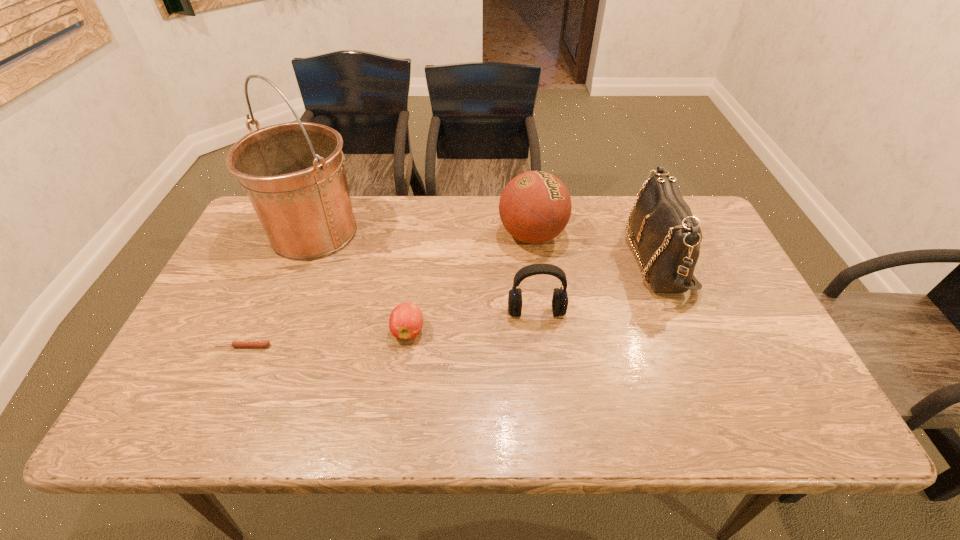
The image size is (960, 540). What are the coordinates of `object that is positioned at the right edge` in the screenshot? It's located at (667, 235).

At what (x,y) coordinates should I click in order to perform the action: click on object that is at the far left corner. Please return your answer as a coordinate pair (x, y). Looking at the image, I should click on [294, 174].

What are the coordinates of `object located in the far right corner section of the desktop` in the screenshot? It's located at [667, 235].

This screenshot has height=540, width=960. I want to click on vacant space at the far edge, so click(376, 238).

The image size is (960, 540). Find the location of `vacant region at the near edge of the desktop`. vacant region at the near edge of the desktop is located at coordinates (357, 398).

The height and width of the screenshot is (540, 960). I want to click on vacant space at the right edge of the desktop, so click(x=780, y=370).

Where is `vacant space at the far left corner of the desktop`? Image resolution: width=960 pixels, height=540 pixels. vacant space at the far left corner of the desktop is located at coordinates (251, 242).

In the image, there is a desktop. Where is `free space at the near left corner`? The image size is (960, 540). free space at the near left corner is located at coordinates (218, 418).

The height and width of the screenshot is (540, 960). In the image, there is a desktop. In order to click on free space at the far right corner in this screenshot , I will do `click(702, 217)`.

I want to click on blank area at the near right corner, so click(x=756, y=409).